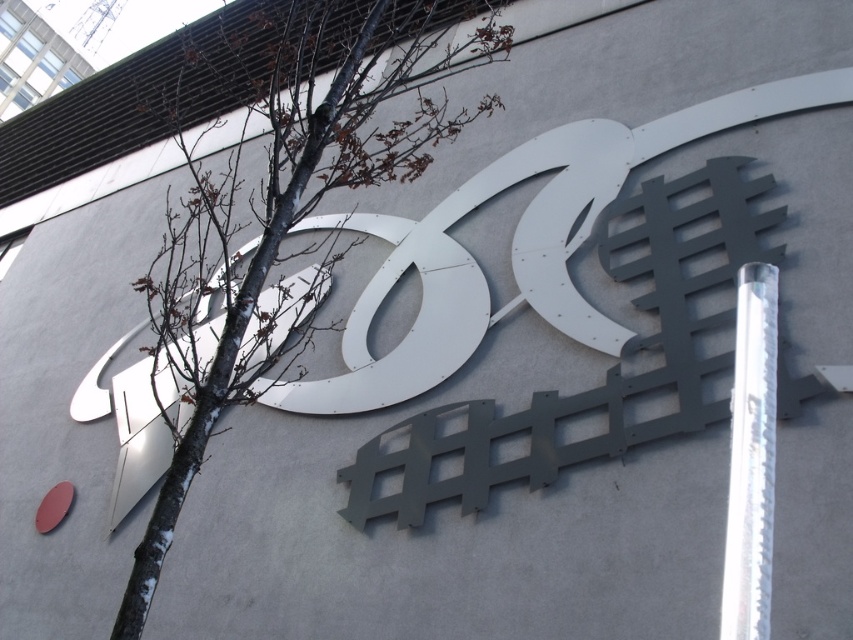
Does bare wood tree at center have a lesser height compared to silver metallic pole at right?

No.

Is bare wood tree at center in front of silver metallic pole at right?

No, it is behind silver metallic pole at right.

Is point (276, 74) farther from camera compared to point (761, 312)?

Yes, point (276, 74) is farther from viewer.

Find the location of a particular element. The image size is (853, 640). bare wood tree at center is located at coordinates (314, 192).